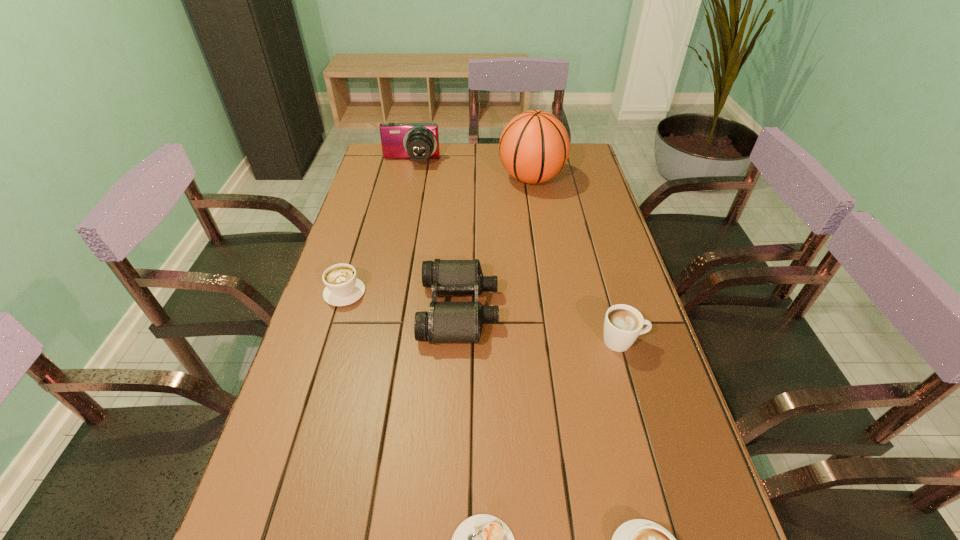
Locate which cappuccino ranks second in proximity to the tallest cappuccino. Please provide its 2D coordinates. Your answer should be formatted as a tuple, i.e. [(x, y)], where the tuple contains the x and y coordinates of a point satisfying the conditions above.

[(482, 539)]

This screenshot has height=540, width=960. Find the location of `vacant space that satisfies the following two spatial constraints: 1. to the right of the tallest object's handle; 2. on the right side of the leftmost cappuccino`. vacant space that satisfies the following two spatial constraints: 1. to the right of the tallest object's handle; 2. on the right side of the leftmost cappuccino is located at coordinates (379, 178).

At what (x,y) coordinates should I click in order to perform the action: click on free space that satisfies the following two spatial constraints: 1. on the front-facing side of the camera; 2. on the left side of the basketball. Please return your answer as a coordinate pair (x, y). This screenshot has height=540, width=960. Looking at the image, I should click on (408, 178).